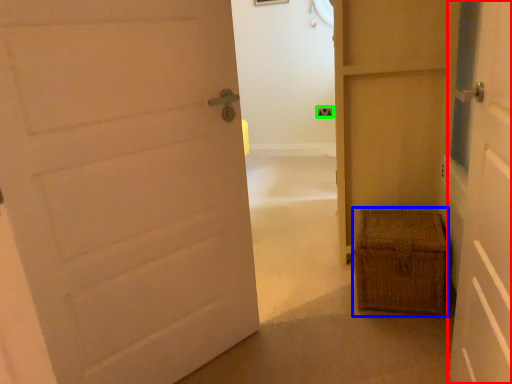
Question: Which object is the closest to the door (highlighted by a red box)? Choose among these: crate (highlighted by a blue box) or electric outlet (highlighted by a green box).

Choices:
 (A) crate
 (B) electric outlet

Answer: (A)